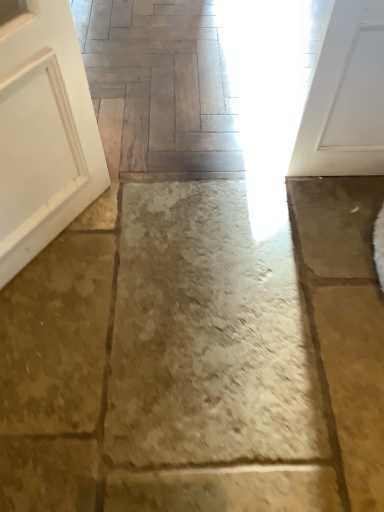
Locate an element on the screen. Image resolution: width=384 pixels, height=512 pixels. beige stone concrete at center is located at coordinates (207, 335).

Describe the element at coordinates (207, 335) in the screenshot. I see `beige stone concrete at center` at that location.

Measure the distance between beige stone concrete at center and camera.

3.38 feet.

At what (x,y) coordinates should I click in order to perform the action: click on beige stone concrete at center. Please return your answer as a coordinate pair (x, y). The height and width of the screenshot is (512, 384). Looking at the image, I should click on (207, 335).